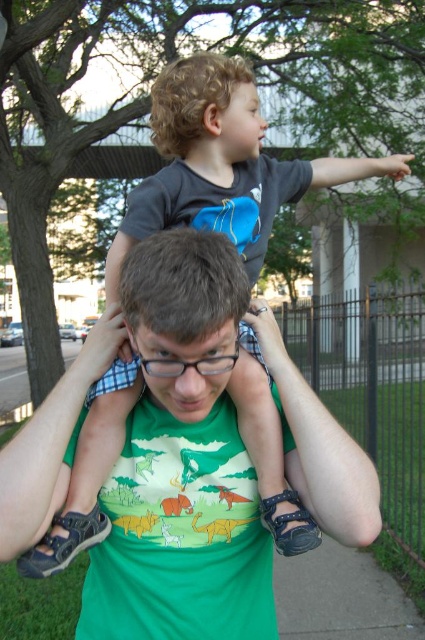
Question: Is green matte shirt at center in front of curly blonde hair at upper center?

Choices:
 (A) no
 (B) yes

Answer: (B)

Question: Can you confirm if green matte shirt at center is positioned to the right of curly blonde hair at upper center?

Choices:
 (A) yes
 (B) no

Answer: (B)

Question: Is green matte shirt at center further to camera compared to curly blonde hair at upper center?

Choices:
 (A) no
 (B) yes

Answer: (A)